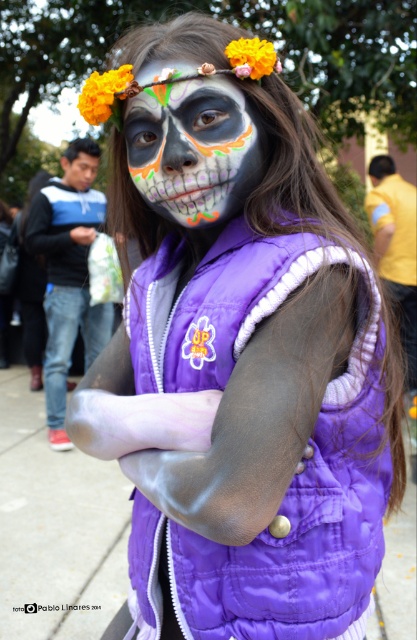
Question: Does matte black face paint at center have a lesser width compared to orange matte flower at upper left?

Choices:
 (A) no
 (B) yes

Answer: (A)

Question: Which of these objects is positioned closest to the matte black face paint at center?

Choices:
 (A) orange matte flower at upper left
 (B) orange matte flower at upper center

Answer: (B)

Question: Does orange matte flower at upper left appear on the left side of orange matte flower at upper center?

Choices:
 (A) yes
 (B) no

Answer: (A)

Question: Among these points, which one is farthest from the camera?

Choices:
 (A) (100, 122)
 (B) (150, 112)
 (C) (238, 45)

Answer: (A)

Question: Can you confirm if orange matte flower at upper left is wider than orange matte flower at upper center?

Choices:
 (A) no
 (B) yes

Answer: (B)

Question: Among these objects, which one is farthest from the camera?

Choices:
 (A) orange matte flower at upper center
 (B) orange matte flower at upper left

Answer: (B)